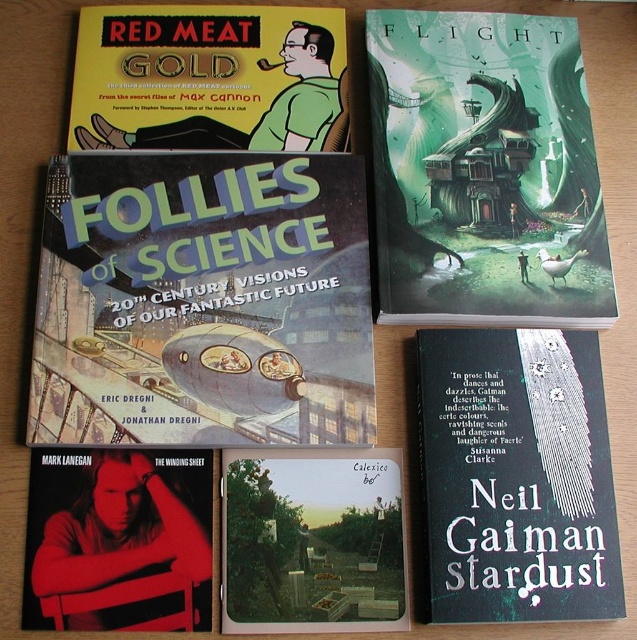
Looking at this image, is green matte house at upper center to the right of matte yellow book at upper left from the viewer's perspective?

Yes, green matte house at upper center is to the right of matte yellow book at upper left.

Is green matte house at upper center taller than matte yellow book at upper left?

Indeed, green matte house at upper center has a greater height compared to matte yellow book at upper left.

Which is in front, point (506, 83) or point (294, 88)?

Point (294, 88) is in front.

Where is `green matte house at upper center`? The image size is (637, 640). green matte house at upper center is located at coordinates (483, 170).

Which is more to the left, matte blue book at center or black matte book at lower right?

From the viewer's perspective, matte blue book at center appears more on the left side.

Who is shorter, matte blue book at center or black matte book at lower right?

black matte book at lower right

Is point (269, 160) more distant than point (452, 480)?

Yes, point (269, 160) is behind point (452, 480).

What are the coordinates of `matte blue book at center` in the screenshot? It's located at (203, 301).

Does black matte book at lower right appear on the right side of matte yellow book at upper left?

Yes, black matte book at lower right is to the right of matte yellow book at upper left.

Between point (592, 368) and point (124, 90), which one is positioned in front?

Positioned in front is point (592, 368).

The height and width of the screenshot is (640, 637). I want to click on black matte book at lower right, so click(x=517, y=476).